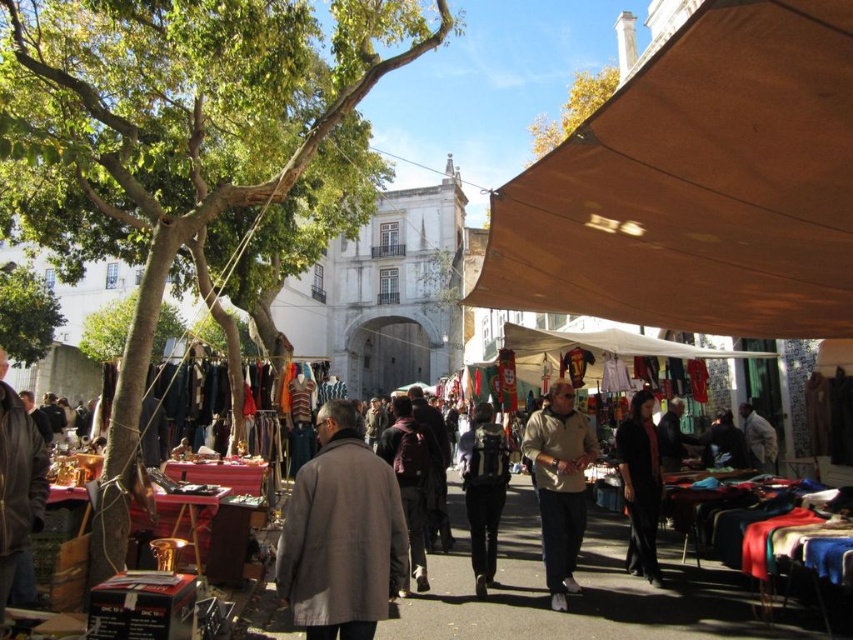
Question: Which object is the farthest from the light brown fabric jacket at center?

Choices:
 (A) brown canvas canopy at upper right
 (B) dark gray wool coat at center
 (C) matte brown table at center
 (D) dark brown backpack at center

Answer: (B)

Question: Can you confirm if brown canvas canopy at upper right is positioned to the left of matte brown table at center?

Choices:
 (A) yes
 (B) no

Answer: (B)

Question: Which is nearer to the dark gray backpack at center?

Choices:
 (A) black matte pants at center
 (B) dark gray wool coat at center
 (C) dark gray coat at center

Answer: (A)

Question: Is light brown fabric jacket at center bigger than dark gray backpack at center?

Choices:
 (A) no
 (B) yes

Answer: (B)

Question: Is matte brown table at center to the right of black matte pants at center from the viewer's perspective?

Choices:
 (A) yes
 (B) no

Answer: (B)

Question: Which of the following is the farthest from the observer?

Choices:
 (A) dark brown backpack at center
 (B) dark gray backpack at center

Answer: (B)